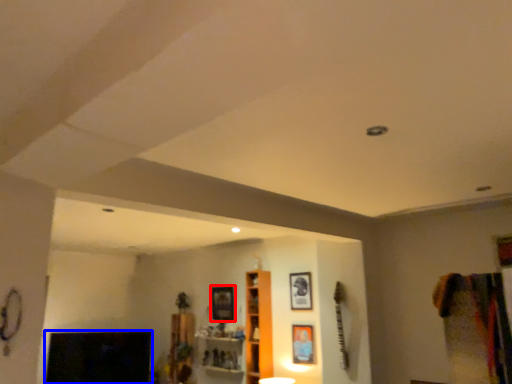
Question: Which object appears closest to the camera in this image, picture frame (highlighted by a red box) or fireplace (highlighted by a blue box)?

Choices:
 (A) picture frame
 (B) fireplace

Answer: (A)